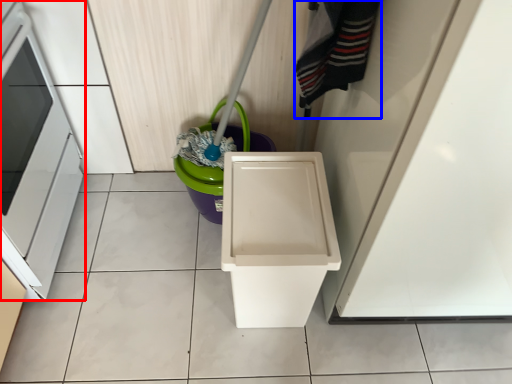
Question: Which point is closer to the camera, oven (highlighted by a red box) or clothing (highlighted by a blue box)?

Choices:
 (A) oven
 (B) clothing

Answer: (B)